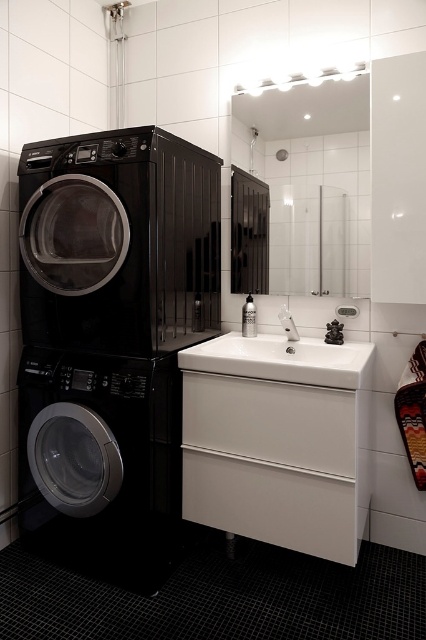
You are a delivery person who just arrived with a new laundry detergent box that measures 18 inches in width. You need to place it between the black glossy washing machine at left and the satin nickel faucet at sink center. Will the detergent box fit in that space?

The distance between the black glossy washing machine at left and the satin nickel faucet at sink center is 35.33 inches. Since the detergent box is 18 inches wide, it will fit with approximately 17.33 inches of space remaining.

You are a home inspector assessing the bathroom layout. You need to determine if the black matte washing machine at left is positioned higher than the white glossy sink at center. Based on the scene description, what can you conclude?

The black matte washing machine at left is located above the white glossy sink at center, so it is positioned higher than the sink.

In the scene shown: You are standing in the bathroom and need to reach the white glossy sink at center to wash your hands. There is a black matte washing machine at left in your way. Which direction should you move to avoid the washing machine?

Since the black matte washing machine at left is to the left of the white glossy sink at center, you should move to the right to avoid the washing machine and reach the sink.